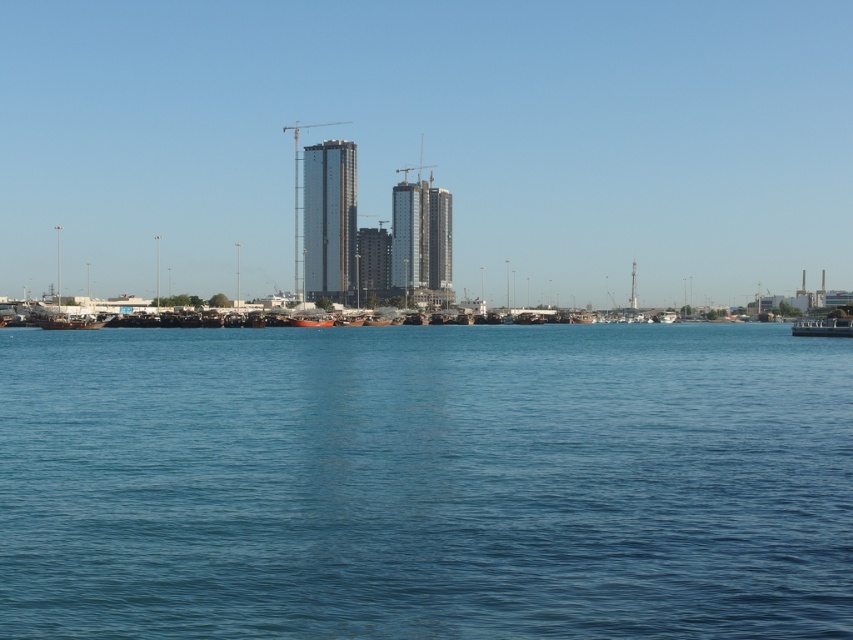
Question: Which is nearer to the blue water at center?

Choices:
 (A) red wooden boat at center
 (B) wooden boat at lower right
 (C) shiny glass tower at center

Answer: (B)

Question: Estimate the real-world distances between objects in this image. Which object is closer to the shiny glass tower at center?

Choices:
 (A) glassy metallic skyscraper at center
 (B) wooden boat at lower right
 (C) red wooden boat at center

Answer: (A)

Question: Is blue water at center further to camera compared to glassy metallic skyscraper at center?

Choices:
 (A) yes
 (B) no

Answer: (B)

Question: Is glassy metallic skyscraper at center in front of red wooden boat at center?

Choices:
 (A) yes
 (B) no

Answer: (B)

Question: Is blue water at center smaller than glassy metallic skyscraper at center?

Choices:
 (A) no
 (B) yes

Answer: (A)

Question: Which object appears farthest from the camera in this image?

Choices:
 (A) blue water at center
 (B) glassy metallic skyscraper at center
 (C) red wooden boat at center

Answer: (B)